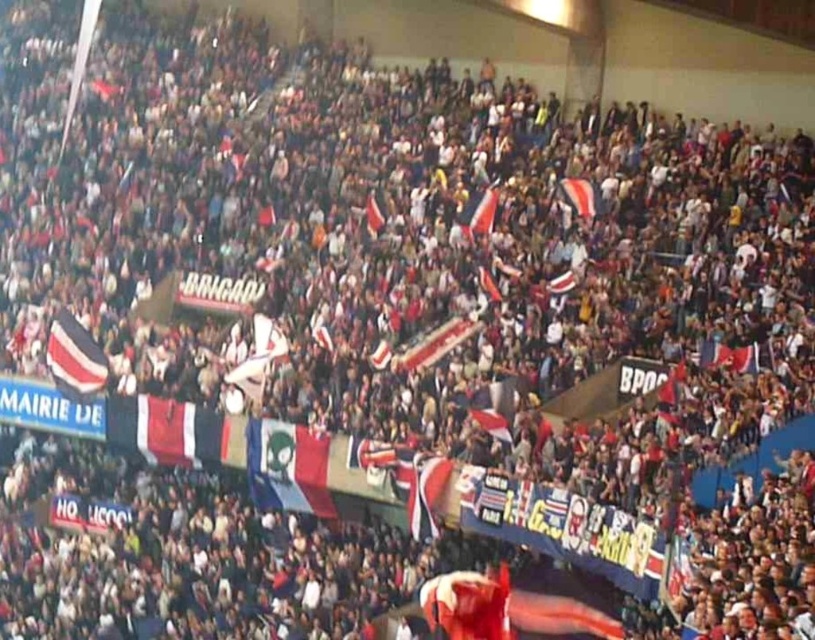
You are a photographer standing at the origin point of the coordinate system. You want to take a photo of the tricolor fabric flag at center. What are the coordinates where you should aim your camera?

The coordinates where you should aim your camera are at point (289, 467).